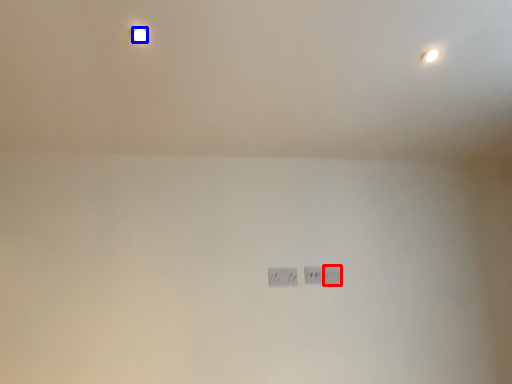
Question: Which object is closer to the camera taking this photo, power plugs and sockets (highlighted by a red box) or light bulb (highlighted by a blue box)?

Choices:
 (A) power plugs and sockets
 (B) light bulb

Answer: (B)